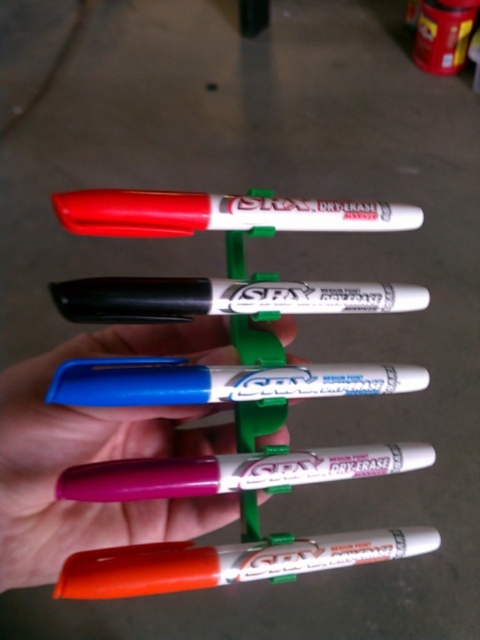
Question: Can you confirm if matte orange marker at center is smaller than matte purple marker at center?

Choices:
 (A) no
 (B) yes

Answer: (A)

Question: Which of the following is the closest to the observer?

Choices:
 (A) (116, 312)
 (B) (370, 208)
 (C) (216, 499)

Answer: (A)

Question: Among these points, which one is farthest from the camera?

Choices:
 (A) (240, 467)
 (B) (251, 560)
 (C) (120, 212)

Answer: (B)

Question: Is purple matte marker at center above matte orange marker at center?

Choices:
 (A) yes
 (B) no

Answer: (A)

Question: In this image, where is purple matte marker at center located relative to matte orange marker at center?

Choices:
 (A) right
 (B) left

Answer: (B)

Question: Which of these objects is positioned closest to the matte orange marker at center?

Choices:
 (A) purple matte marker at center
 (B) matte white marker at center
 (C) white glossy marker at center

Answer: (A)